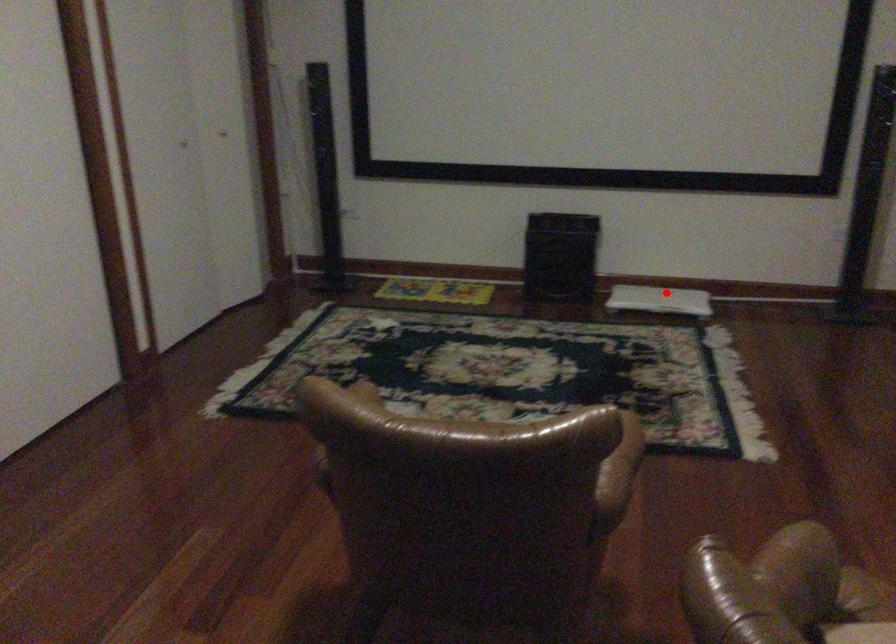
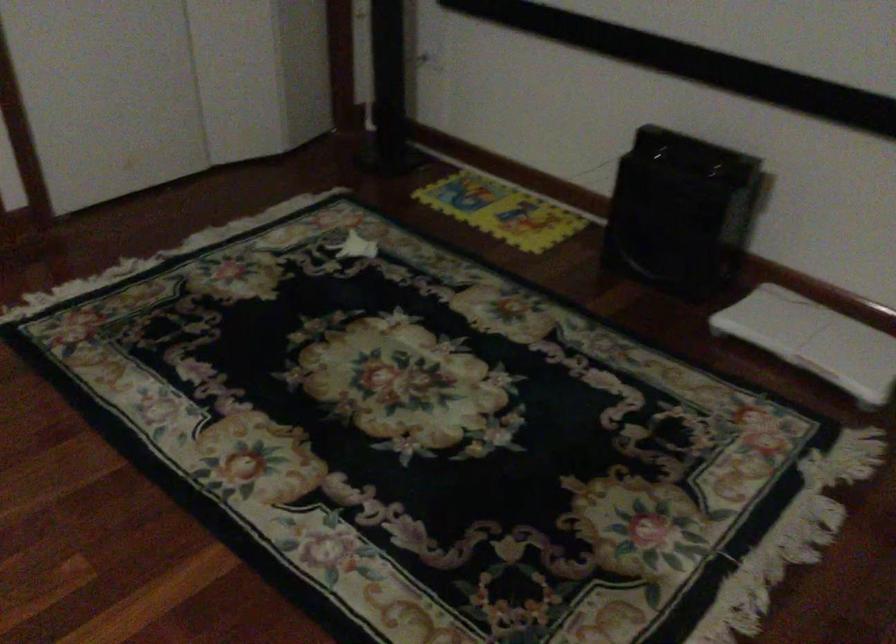
Locate, in the second image, the point that corresponds to the highlighted location in the first image.

(814, 339)